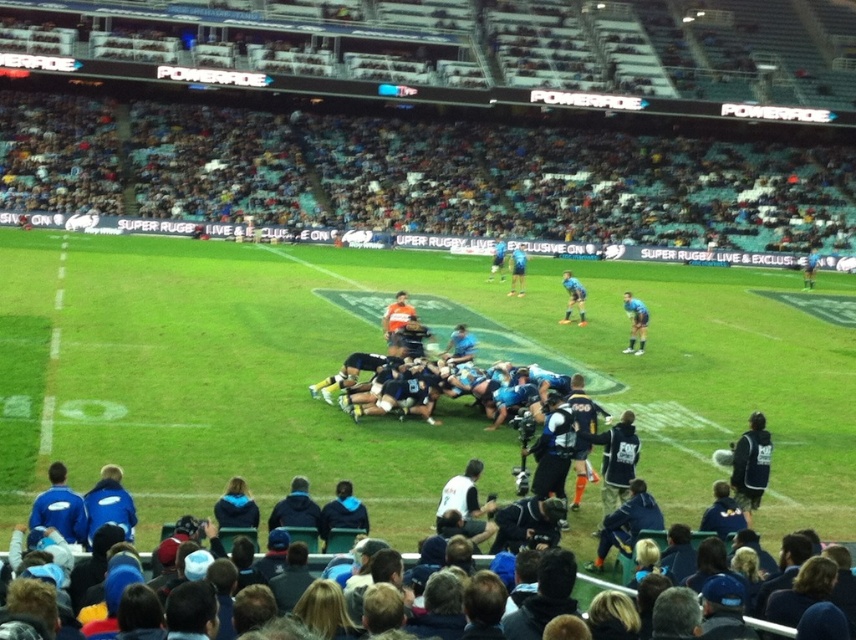
Question: Can you confirm if blue fabric seats at upper center is smaller than blue fabric jersey at center?

Choices:
 (A) no
 (B) yes

Answer: (A)

Question: Observing the image, what is the correct spatial positioning of blue jersey at center in reference to blue fabric jersey at center?

Choices:
 (A) right
 (B) left

Answer: (A)

Question: Considering the real-world distances, which object is farthest from the blue fabric jersey at center?

Choices:
 (A) blue fabric shirt at center
 (B) blue fabric seats at upper center
 (C) blue jersey at center

Answer: (B)

Question: Which object appears farthest from the camera in this image?

Choices:
 (A) blue jersey at center
 (B) blue fabric shirt at center
 (C) blue fabric seats at upper center

Answer: (C)

Question: Is blue fabric seats at upper center above blue jersey at center?

Choices:
 (A) no
 (B) yes

Answer: (B)

Question: Which point is closer to the camera?

Choices:
 (A) blue jersey at center
 (B) blue fabric seats at upper center
 (C) blue fabric jersey at center

Answer: (A)